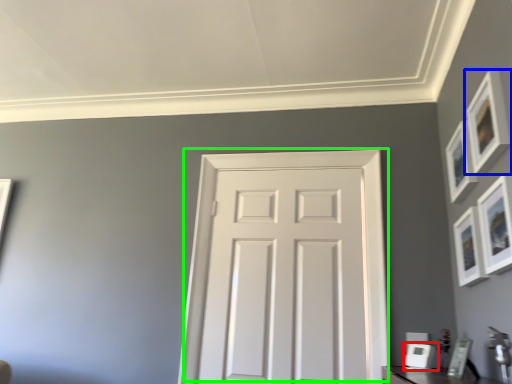
Question: Based on their relative distances, which object is farther from picture frame (highlighted by a red box)? Choose from picture frame (highlighted by a blue box) and door (highlighted by a green box).

Choices:
 (A) picture frame
 (B) door

Answer: (A)